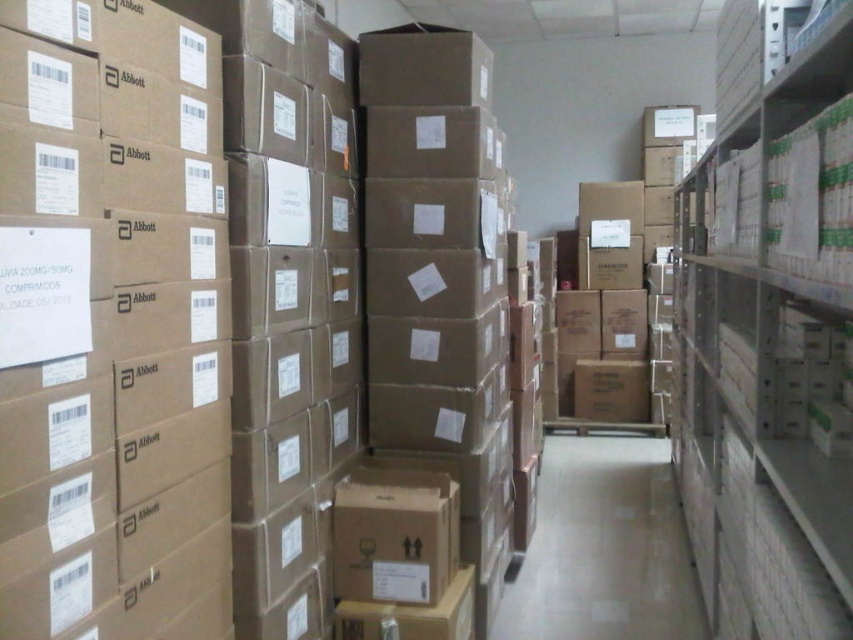
Is white cardboard boxes at right further to camera compared to white glossy aisle at center?

No, it is not.

Is white cardboard boxes at right above white glossy aisle at center?

Yes, white cardboard boxes at right is above white glossy aisle at center.

Which is behind, point (769, 282) or point (701, 627)?

Positioned behind is point (701, 627).

You are a GUI agent. You are given a task and a screenshot of the screen. Output one action in this format:
    pyautogui.click(x=<x>, y=<y>)
    Task: Click on the white cardboard boxes at right
    This screenshot has width=853, height=640.
    Given the screenshot: What is the action you would take?
    (770, 353)